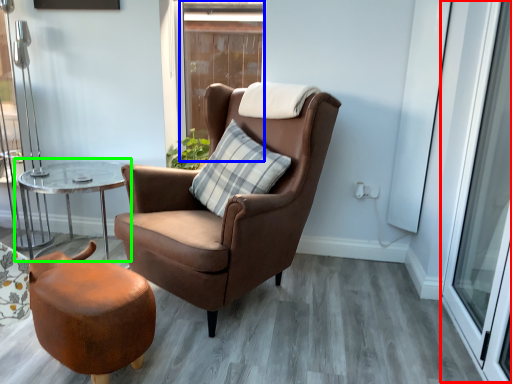
Question: Estimate the real-world distances between objects in this image. Which object is closer to screen door (highlighted by a red box), window (highlighted by a blue box) or table (highlighted by a green box)?

Choices:
 (A) window
 (B) table

Answer: (B)